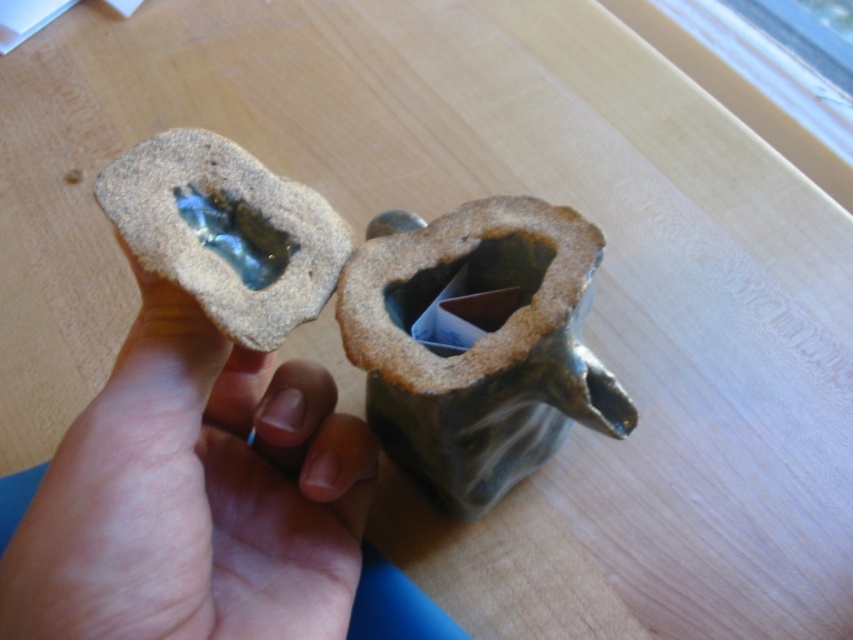
You are an artist preparing materials for a sculpture. You have a matte brown hand at center and a translucent glass at center. Which object is wider when viewed from above?

The matte brown hand at center is wider than the translucent glass at center when viewed from above.

You are a delivery robot with a 3.5 inch wide arm. You need to place an object between the matte brown hand at center and the translucent glass at center. Can your arm fit in the space between them?

The distance between the matte brown hand at center and the translucent glass at center is 4.44 inches, so yes, the robot arm can fit since it is narrower than the available space.

Looking at this image, you are an interior designer arranging items on a narrow shelf. You have the green matte vase at center and the translucent glass at center. Which object should you place first to ensure they both fit on the shelf?

The translucent glass at center has a narrower width than the green matte vase at center. Place the wider green matte vase at center first to accommodate both items on the shelf.